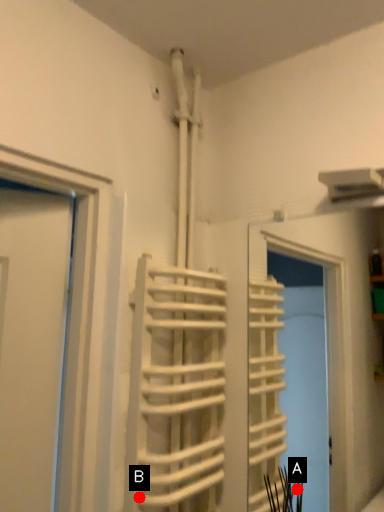
Question: Two points are circled on the image, labeled by A and B beside each circle. Among these points, which one is nearest to the camera?

Choices:
 (A) A is closer
 (B) B is closer

Answer: (B)